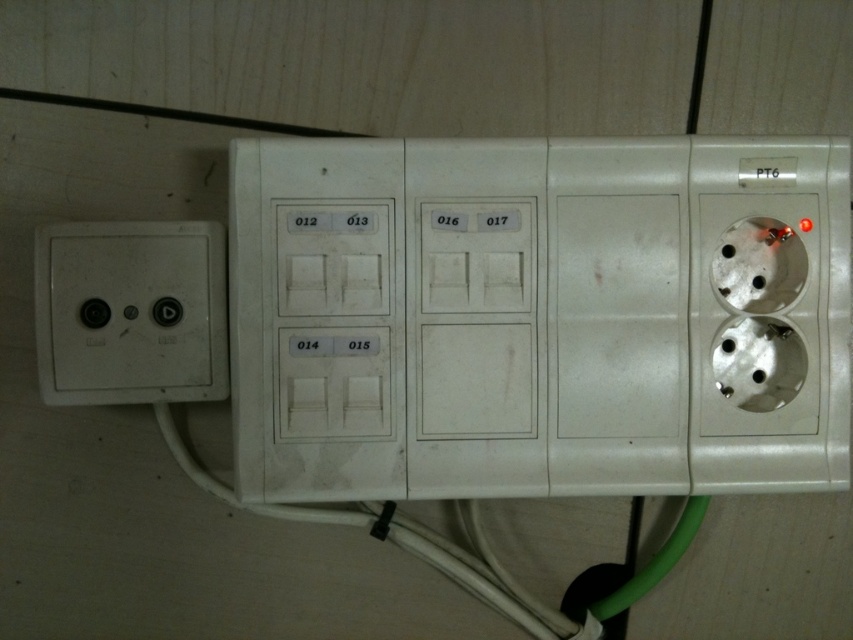
You need to plug in a device into the white plastic socket at center and the white matte socket at left. Based on their positions, which socket should you reach for first if you are standing to the left of both sockets?

You should reach for the white matte socket at left first because it is positioned to the left of the white plastic socket at center, making it closer to your current position.

You are standing in front of the power strip and need to reach the point labeled with coordinates. Which coordinate point is closer to you, point [306,260] or point [140,285]?

Point [140,285] is closer to you because point [306,260] is behind it.

You are a technician who needs to connect a device to the white plastic socket at center. The device requires a cable that is 30 inches long. Is the cable long enough to reach the socket from your current position?

The white plastic socket at center is 33.63 inches away, so the 30 inch cable is not long enough to reach it.